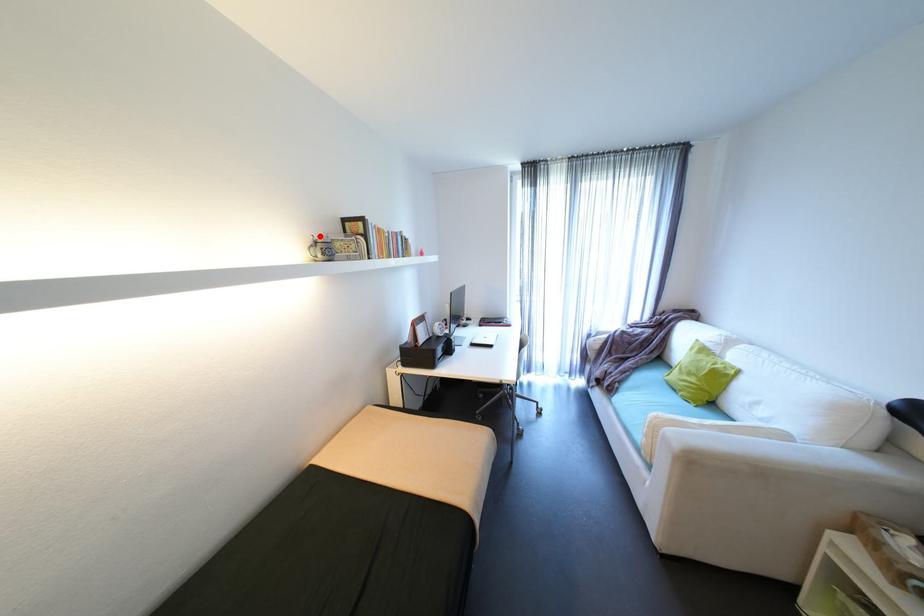
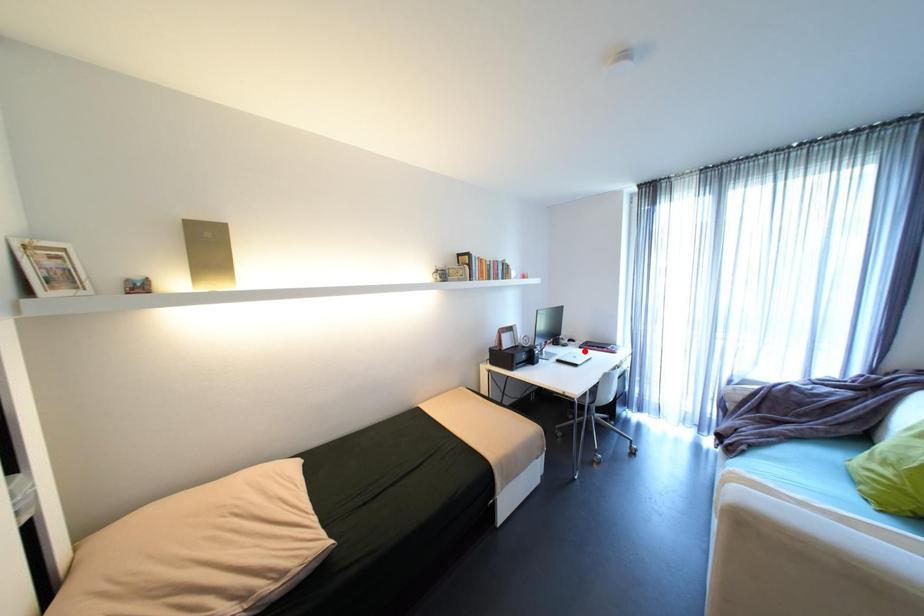
I am providing you with two images of the same scene from different viewpoints. A red point is marked on the first image and another point is marked on the second image. Is the marked point in image1 the same physical position as the marked point in image2?

No